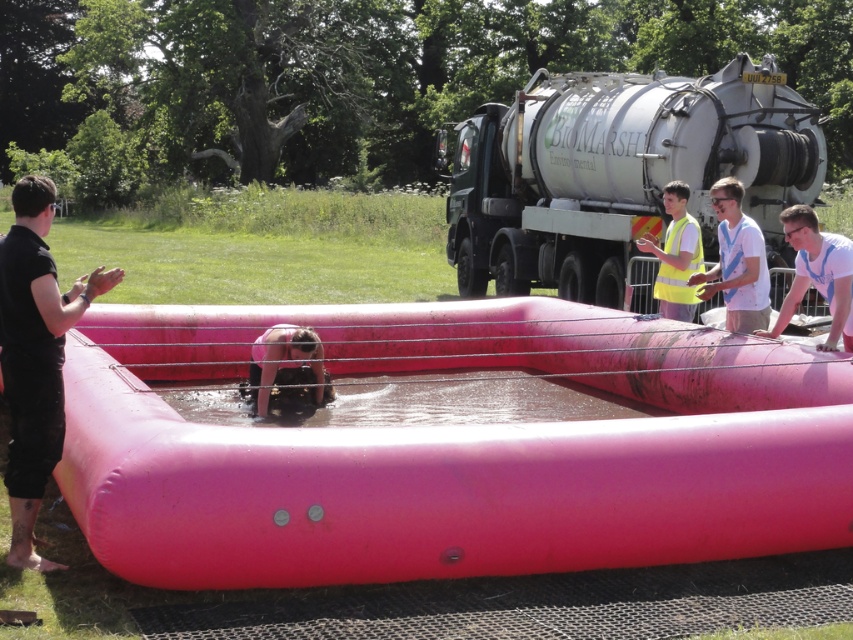
You are standing at the point labeled point (782, 429) and want to throw a ball to reach the point labeled point (691, 220). Considering the spatial relationship between these two points, will the ball travel towards the tanker truck or away from it?

The point labeled point (782, 429) is closer to the camera than point labeled point (691, 220). Since the tanker truck is parked in the background, throwing the ball from the closer point towards the farther point would mean the ball is moving away from the tanker truck.